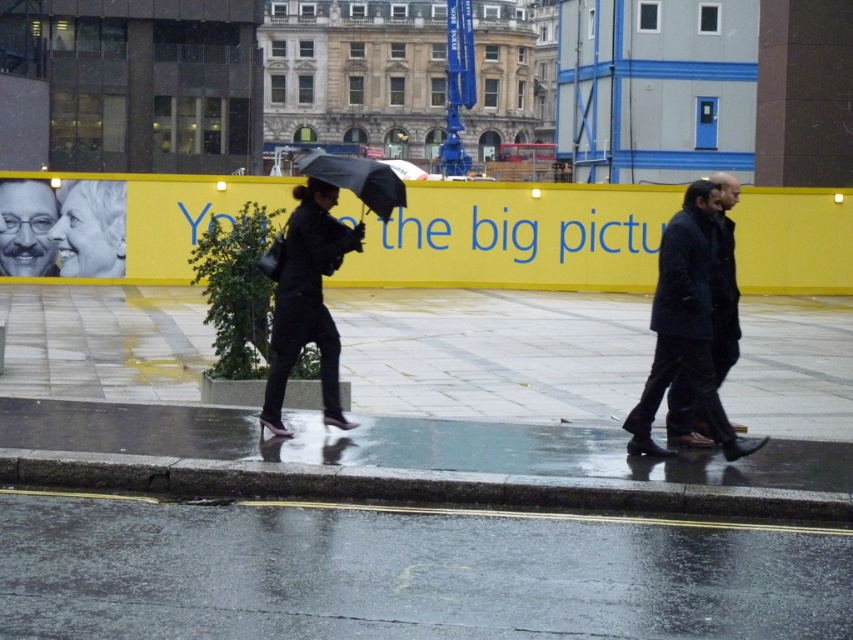
You are a delivery person who needs to cross the shiny asphalt road at lower center. There are two pedestrians walking towards you from opposite directions. They are 5.67 meters apart. If both pedestrians walk at a constant speed of 1.5 m per second towards each other, how many seconds will it take before they meet? Please provide your answer in seconds rounded to two decimal places.

The two pedestrians are 5.67 meters apart and moving towards each other at 1.5 m per second each. Their combined speed is 3 m per second. Time until meeting is distance divided by speed, so 5.67 meters divided by 3 m per second equals 1.89 seconds.

You are a pedestrian trying to cross the street in the rainy scene. You see a dark blue jacket at center and a transparent plastic umbrella at center. Which object is closer to the left side of the street?

The transparent plastic umbrella at center is closer to the left side of the street because the dark blue jacket at center is to the right of it.

You are an artist standing in the rainy city scene. You notice the matte black portrait at upper left and the dark blue jacket at center. Which object is shorter in height?

The matte black portrait at upper left is not as tall as the dark blue jacket at center, so the matte black portrait at upper left is shorter in height.